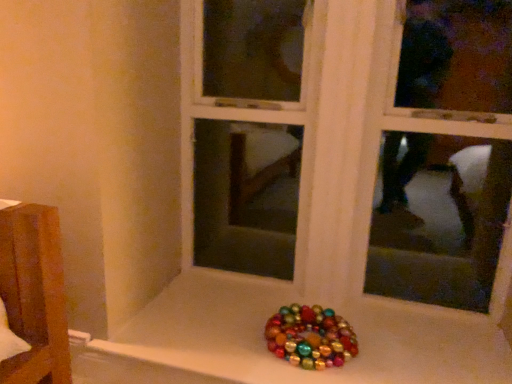
This screenshot has height=384, width=512. Find the location of `vacant area to the left of multicolored glossy beads at bottom center`. vacant area to the left of multicolored glossy beads at bottom center is located at coordinates (228, 336).